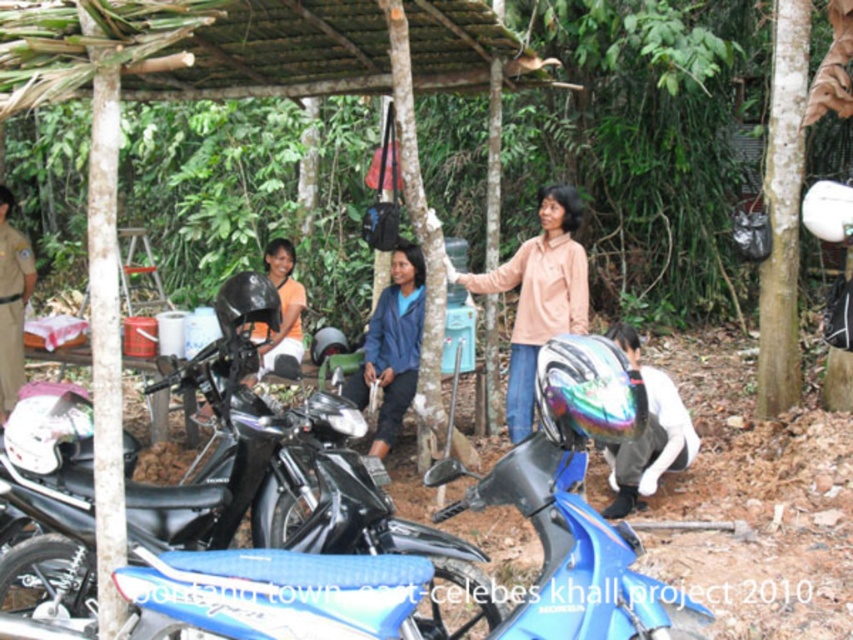
You are a safety inspector at the motorcycle event. You notice two helmets, the rainbow reflective helmet at lower right and the matte black helmet at left. According to safety regulations, helmets must be placed above other helmets for visibility. Are these helmets arranged correctly?

The rainbow reflective helmet at lower right is positioned under the matte black helmet at left, so they are not arranged correctly. The rainbow reflective helmet at lower right should be placed above the matte black helmet at left to comply with safety regulations.